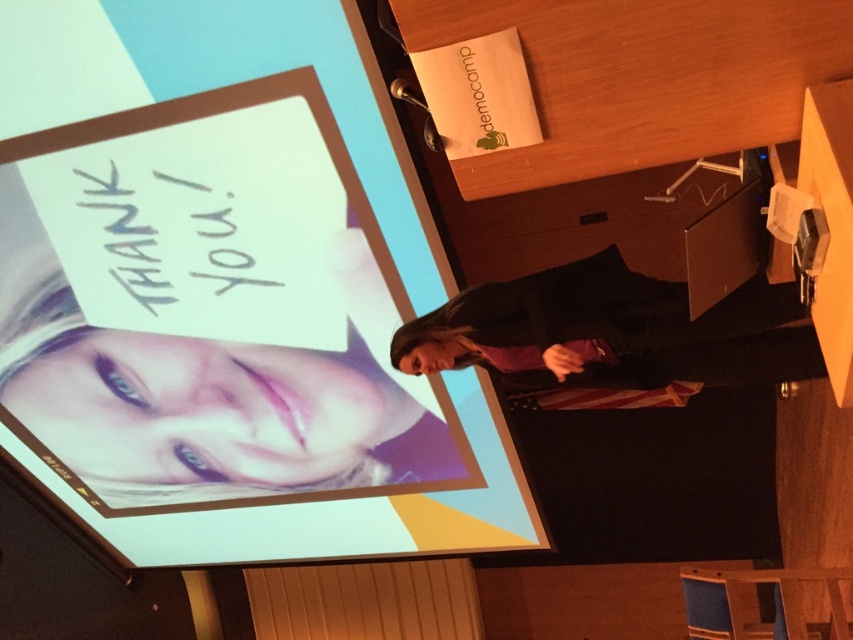
Is smooth skin face at center taller than black fabric at center?

Yes.

Is point (167, 422) behind point (532, 289)?

Yes, it is behind point (532, 289).

Which is in front, point (172, 413) or point (769, 312)?

Positioned in front is point (769, 312).

This screenshot has width=853, height=640. Identify the location of smooth skin face at center. (218, 401).

Is point (325, 61) farther from camera compared to point (234, 422)?

That is False.

Consider the image. Which is above, matte plastic projection screen at center or smooth skin face at center?

smooth skin face at center is higher up.

The width and height of the screenshot is (853, 640). I want to click on matte plastic projection screen at center, so click(218, 84).

Does matte plastic projection screen at center have a larger size compared to black fabric at center?

Correct, matte plastic projection screen at center is larger in size than black fabric at center.

Is point (82, 3) positioned behind point (668, 324)?

Yes, it is behind point (668, 324).

Between point (207, 3) and point (445, 340), which one is positioned behind?

Point (445, 340)

In order to click on matte plastic projection screen at center in this screenshot , I will do `click(218, 84)`.